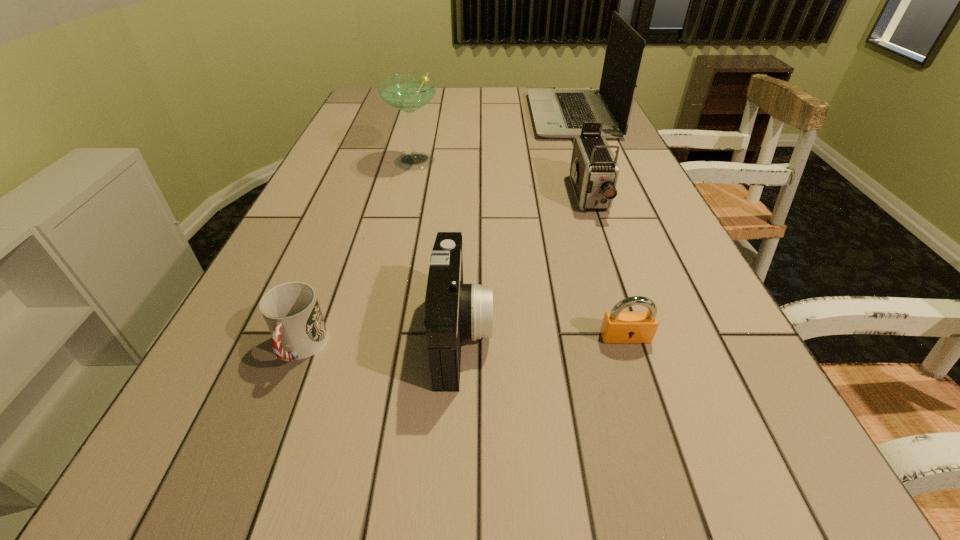
What are the coordinates of `free region located 0.210m on the screen of the laptop computer` in the screenshot? It's located at (469, 116).

Where is `free space located 0.050m on the screen of the laptop computer`? This screenshot has height=540, width=960. free space located 0.050m on the screen of the laptop computer is located at coordinates point(516,116).

Image resolution: width=960 pixels, height=540 pixels. Find the location of `blank area located 0.140m on the left of the martini`. blank area located 0.140m on the left of the martini is located at coordinates (339, 163).

You are a GUI agent. You are given a task and a screenshot of the screen. Output one action in this format:
    pyautogui.click(x=<x>, y=<y>)
    Task: Click on the vacant space situated at the lens of the farther camcorder
    The image size is (960, 540).
    Given the screenshot: What is the action you would take?
    pyautogui.click(x=609, y=254)

This screenshot has width=960, height=540. Find the location of `vacant area situated on the lens of the nearer camcorder`. vacant area situated on the lens of the nearer camcorder is located at coordinates (711, 334).

Identify the location of vacant space located on the side of the cup where the handle is located. The image size is (960, 540). (262, 449).

You are a GUI agent. You are given a task and a screenshot of the screen. Output one action in this format:
    pyautogui.click(x=<x>, y=<y>)
    Task: Click on the vacant space located 0.150m to unlock the padlock from the front
    
    Given the screenshot: What is the action you would take?
    pyautogui.click(x=653, y=423)

Where is `object at the far edge`? This screenshot has height=540, width=960. object at the far edge is located at coordinates (558, 113).

Identify the location of object that is at the left edge. The image size is (960, 540). (291, 310).

Where is `laptop computer positioned at the right edge`? The height and width of the screenshot is (540, 960). laptop computer positioned at the right edge is located at coordinates (558, 113).